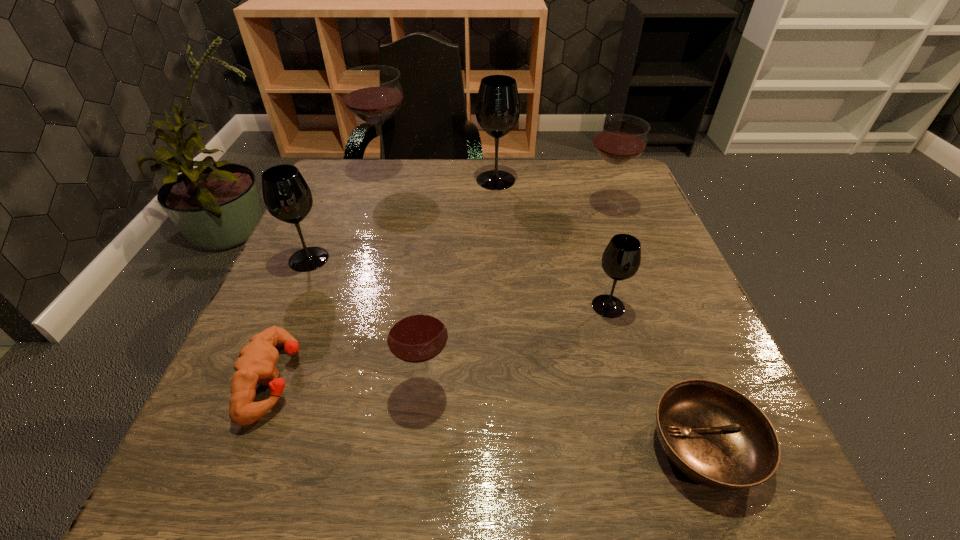
Where is `free space between the shortest object and the third wineglass from left to right`? free space between the shortest object and the third wineglass from left to right is located at coordinates (564, 416).

Locate an element on the screen. Image resolution: width=960 pixels, height=540 pixels. free space that is in between the third farthest object and the fifth object from right to left is located at coordinates (516, 295).

Find the location of `free area in between the third nearest wineglass and the biggest red wineglass`. free area in between the third nearest wineglass and the biggest red wineglass is located at coordinates (348, 216).

In order to click on free point between the second farthest gray wineglass and the farthest red wineglass in this screenshot , I will do `click(348, 216)`.

Find the location of a particular element. This screenshot has height=540, width=960. vacant area that lies between the second nearest gray wineglass and the nearest red wineglass is located at coordinates (367, 322).

Where is `the fourth closest object to the red puncher`? the fourth closest object to the red puncher is located at coordinates (621, 259).

Select which object is the fifth closest to the nearest gray wineglass. Please provide its 2D coordinates. Your answer should be formatted as a tuple, i.e. [(x, y)], where the tuple contains the x and y coordinates of a point satisfying the conditions above.

[(256, 364)]

The width and height of the screenshot is (960, 540). I want to click on wineglass that is the fourth closest one to the fourth wineglass from left to right, so click(x=621, y=259).

Identify which wineglass is the sixth nearest to the puncher. Please provide its 2D coordinates. Your answer should be formatted as a tuple, i.e. [(x, y)], where the tuple contains the x and y coordinates of a point satisfying the conditions above.

[(620, 138)]

Identify which gray wineglass is the nearest to the fourth object from right to left. Please provide its 2D coordinates. Your answer should be formatted as a tuple, i.e. [(x, y)], where the tuple contains the x and y coordinates of a point satisfying the conditions above.

[(287, 197)]